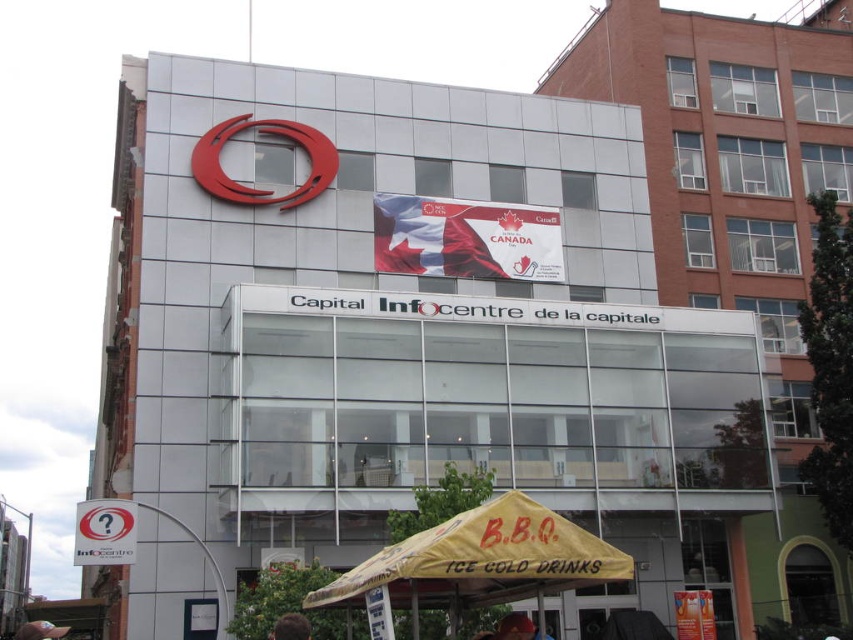
Question: Which of the following is the farthest from the observer?

Choices:
 (A) yellow fabric umbrella at lower center
 (B) white paper sign at lower left
 (C) matte red helmet at lower center

Answer: (B)

Question: Which of the following is the farthest from the observer?

Choices:
 (A) (61, 628)
 (B) (289, 630)

Answer: (A)

Question: Observing the image, what is the correct spatial positioning of matte red helmet at lower center in reference to pink fabric cap at lower left?

Choices:
 (A) right
 (B) left

Answer: (A)

Question: Which object appears farthest from the camera in this image?

Choices:
 (A) white paper sign at lower left
 (B) pink fabric cap at lower left
 (C) matte red helmet at lower center
 (D) brown hair at lower center

Answer: (B)

Question: Is white paper sign at lower left positioned behind brown hair at lower center?

Choices:
 (A) no
 (B) yes

Answer: (B)

Question: Does brown hair at lower center have a greater width compared to pink fabric cap at lower left?

Choices:
 (A) yes
 (B) no

Answer: (B)